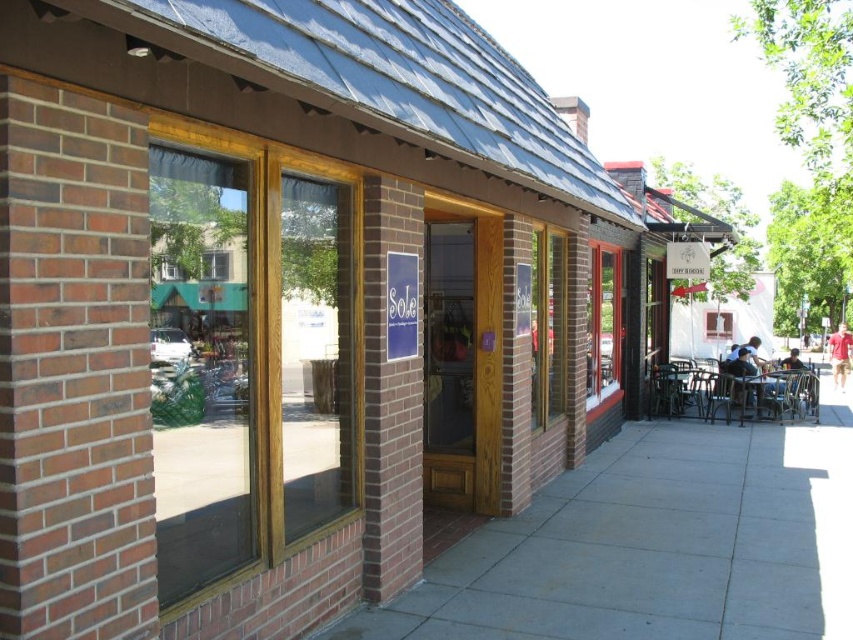
Does clear glass window at center appear on the left side of metallic silver table at lower right?

Yes, clear glass window at center is to the left of metallic silver table at lower right.

Is clear glass window at center to the right of metallic silver table at lower right from the viewer's perspective?

No, clear glass window at center is not to the right of metallic silver table at lower right.

The image size is (853, 640). Identify the location of clear glass window at center. (248, 355).

I want to click on clear glass window at center, so click(248, 355).

Which is more to the left, clear glass window at center or gray concrete sidewalk at center?

From the viewer's perspective, clear glass window at center appears more on the left side.

Does clear glass window at center appear on the left side of gray concrete sidewalk at center?

Yes, clear glass window at center is to the left of gray concrete sidewalk at center.

Is point (207, 490) positioned behind point (624, 433)?

No, it is not.

Where is `clear glass window at center`? The height and width of the screenshot is (640, 853). clear glass window at center is located at coordinates (248, 355).

From the picture: Between gray concrete sidewalk at center and metallic silver table at lower right, which one is positioned lower?

gray concrete sidewalk at center

Does gray concrete sidewalk at center have a greater height compared to metallic silver table at lower right?

In fact, gray concrete sidewalk at center may be shorter than metallic silver table at lower right.

Does point (525, 556) lie behind point (779, 384)?

No, (525, 556) is closer to viewer.

Identify the location of gray concrete sidewalk at center. The height and width of the screenshot is (640, 853). (657, 544).